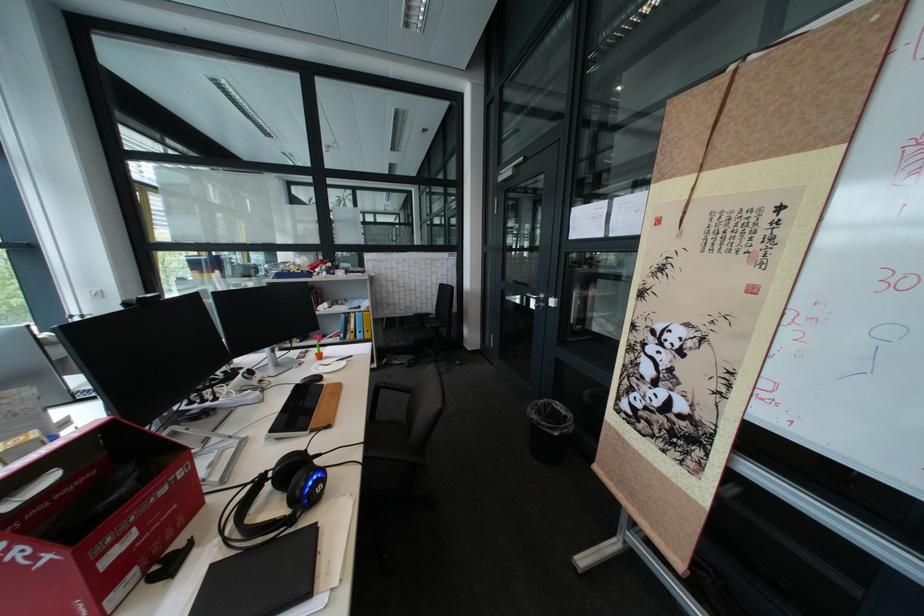
What do you see at coordinates (30, 490) in the screenshot? I see `the cardboard box handle` at bounding box center [30, 490].